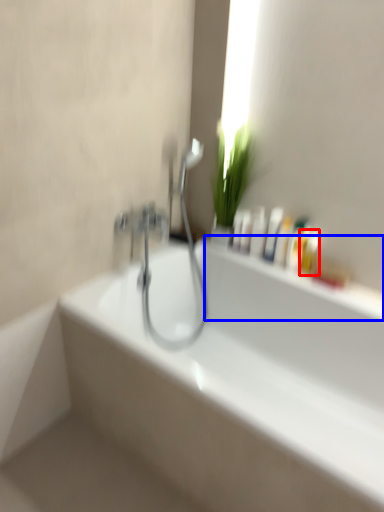
Question: Among these objects, which one is farthest to the camera, mouthwash (highlighted by a red box) or window sill (highlighted by a blue box)?

Choices:
 (A) mouthwash
 (B) window sill

Answer: (A)